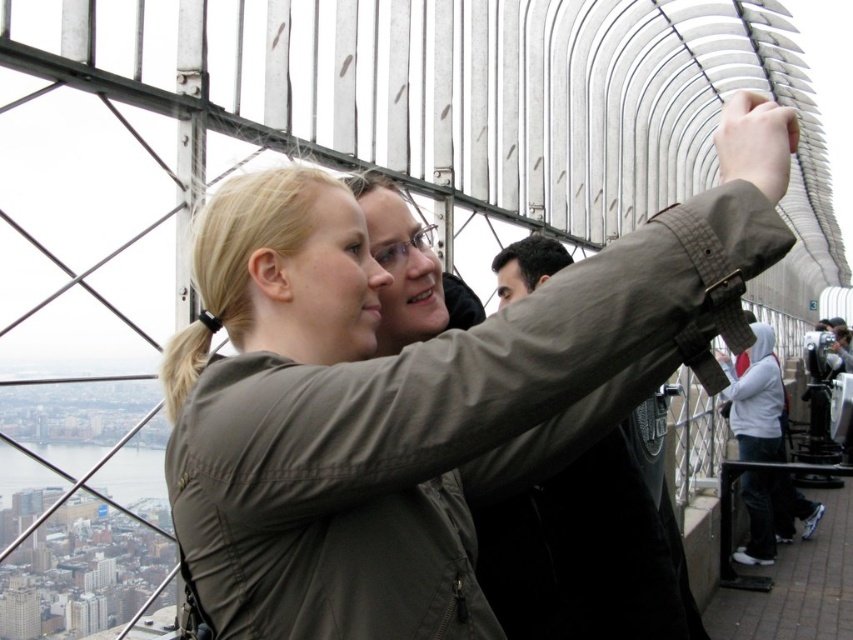
Question: Which point is closer to the camera?

Choices:
 (A) (244, 540)
 (B) (590, 593)

Answer: (A)

Question: Is matte olive green jacket at center bigger than dark brown leather jacket at center?

Choices:
 (A) no
 (B) yes

Answer: (B)

Question: Does matte olive green jacket at center have a smaller size compared to dark gray fabric at upper center?

Choices:
 (A) yes
 (B) no

Answer: (B)

Question: Which of the following is the farthest from the observer?

Choices:
 (A) (529, 244)
 (B) (502, 573)
 (C) (560, 588)

Answer: (A)

Question: Which object is the closest to the matte olive green jacket at center?

Choices:
 (A) dark brown leather jacket at center
 (B) dark gray fabric at upper center
 (C) dark brown hair at center

Answer: (A)

Question: Can you confirm if dark gray fabric at upper center is bigger than dark brown hair at center?

Choices:
 (A) no
 (B) yes

Answer: (B)